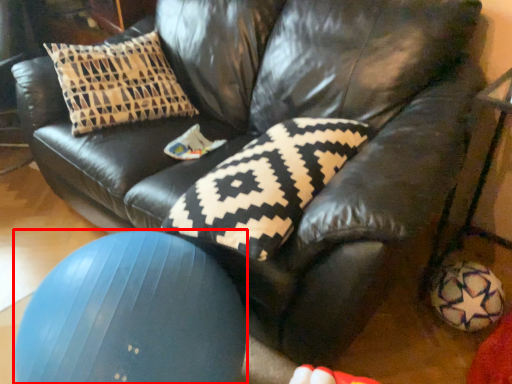
Question: From the image's perspective, what is the correct spatial relationship of ball (annotated by the red box) in relation to pillow?

Choices:
 (A) above
 (B) below

Answer: (B)